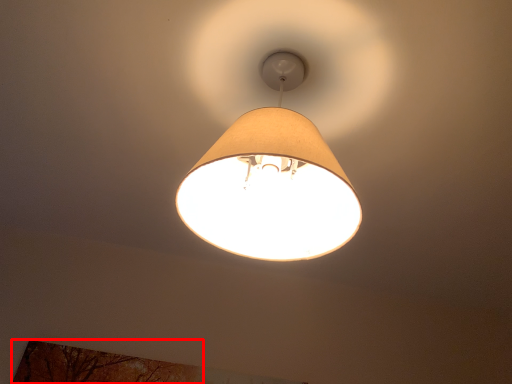
Question: In this image, where is tree (annotated by the red box) located relative to lamp?

Choices:
 (A) left
 (B) right

Answer: (A)